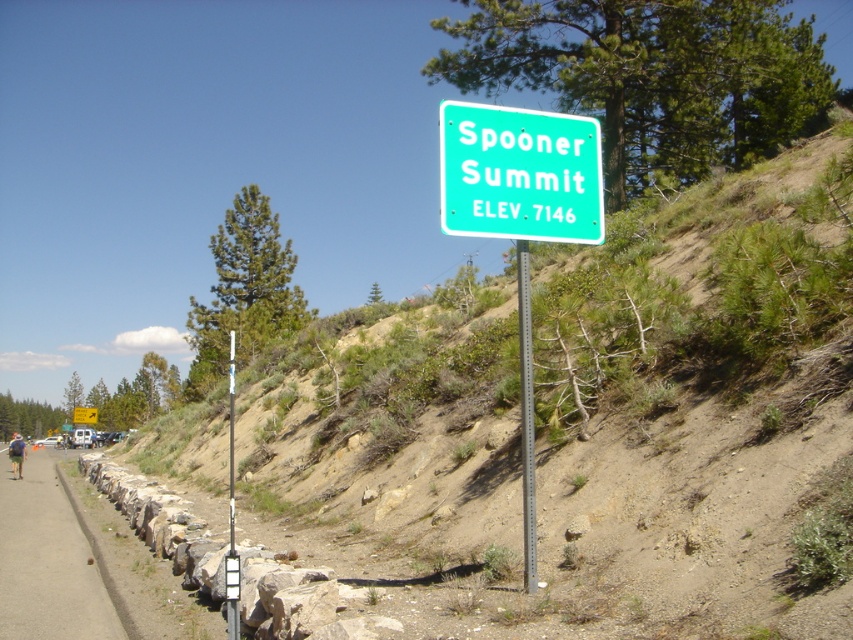
You are a hiker trying to follow the direction indicated by the green plastic arrow at upper right. According to the image, where should you walk relative to the smooth asphalt path at lower left?

The smooth asphalt path at lower left is above the green plastic arrow at upper right, so you should walk below the smooth asphalt path at lower left to follow the direction of the green plastic arrow at upper right.

You are a delivery driver who needs to make a U turn on the road. You see a smooth asphalt path at lower left and a green plastic arrow at upper right. Which one is more suitable for performing a U turn?

The smooth asphalt path at lower left is more suitable for performing a U turn because it is wider than the green plastic arrow at upper right.

What is the color of the object located at point (520,216)?

The object at point (520,216) is green plastic sign at center.